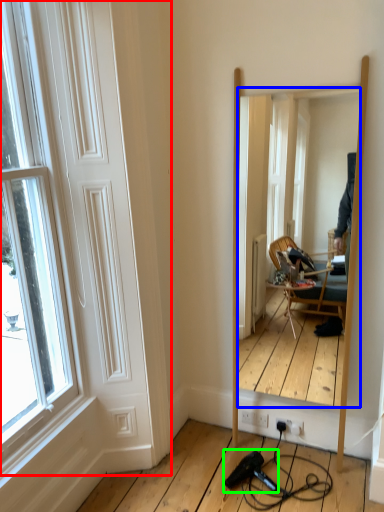
Question: Estimate the real-world distances between objects in this image. Which object is farther from door (highlighted by a red box), mirror (highlighted by a blue box) or hair drier (highlighted by a green box)?

Choices:
 (A) mirror
 (B) hair drier

Answer: (A)